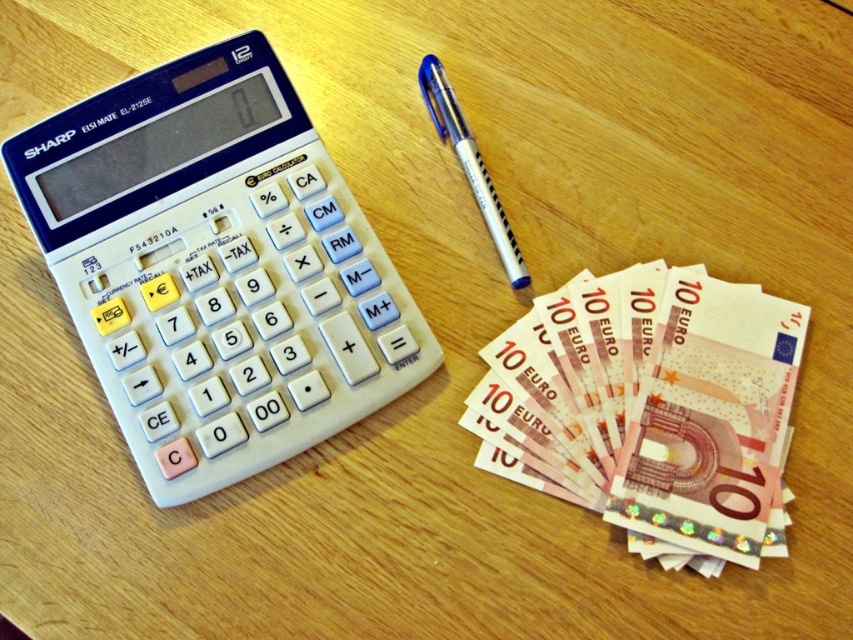
Between point (252, 317) and point (645, 522), which one is positioned behind?

Positioned behind is point (252, 317).

Which of these two, white plastic calculator at upper left or pink paper money at lower right, stands taller?

Standing taller between the two is white plastic calculator at upper left.

Does point (99, 216) come in front of point (659, 289)?

No, it is behind (659, 289).

At what (x,y) coordinates should I click in order to perform the action: click on white plastic calculator at upper left. Please return your answer as a coordinate pair (x, y). The image size is (853, 640). Looking at the image, I should click on (216, 268).

Is point (115, 230) positioned behind point (506, 260)?

Yes, point (115, 230) is farther from viewer.

Which of these two, white plastic calculator at upper left or translucent white pen at center, stands shorter?

Standing shorter between the two is translucent white pen at center.

The image size is (853, 640). I want to click on white plastic calculator at upper left, so click(216, 268).

Can you confirm if pink paper money at lower right is wider than translucent white pen at center?

Yes.

This screenshot has width=853, height=640. I want to click on pink paper money at lower right, so click(x=674, y=408).

Identify the location of pink paper money at lower right. Image resolution: width=853 pixels, height=640 pixels. [674, 408].